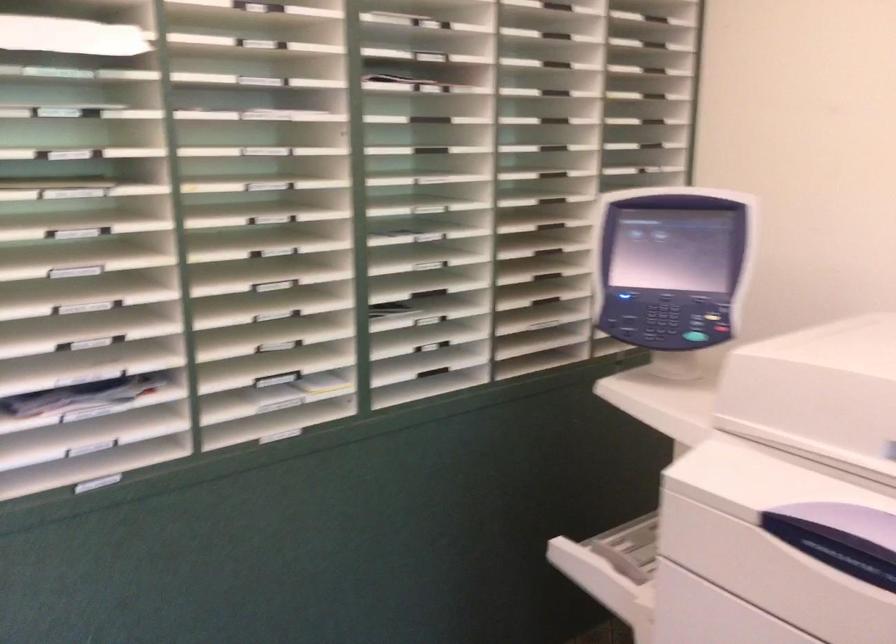
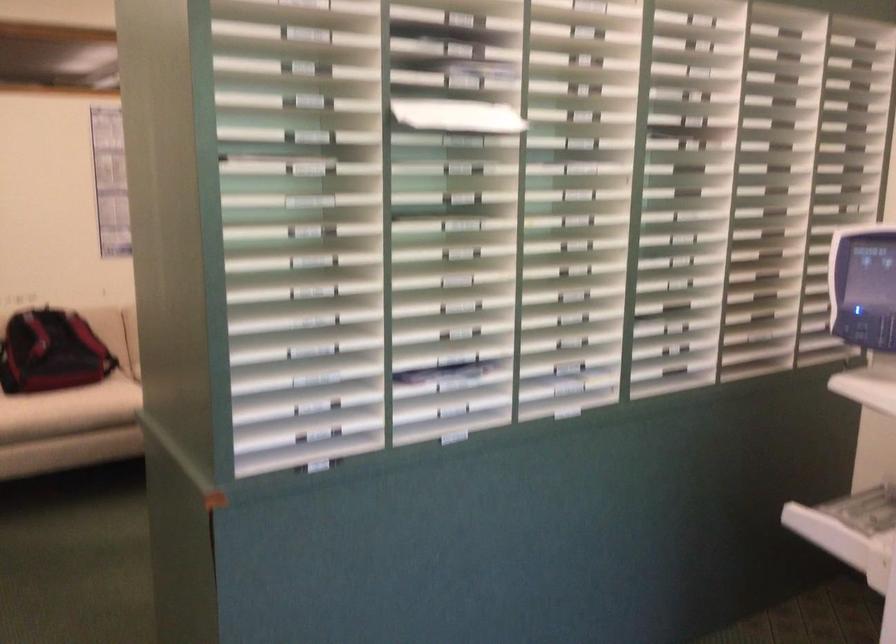
Which direction would the cameraman need to move to produce the second image?

The cameraman walked toward left, backward.